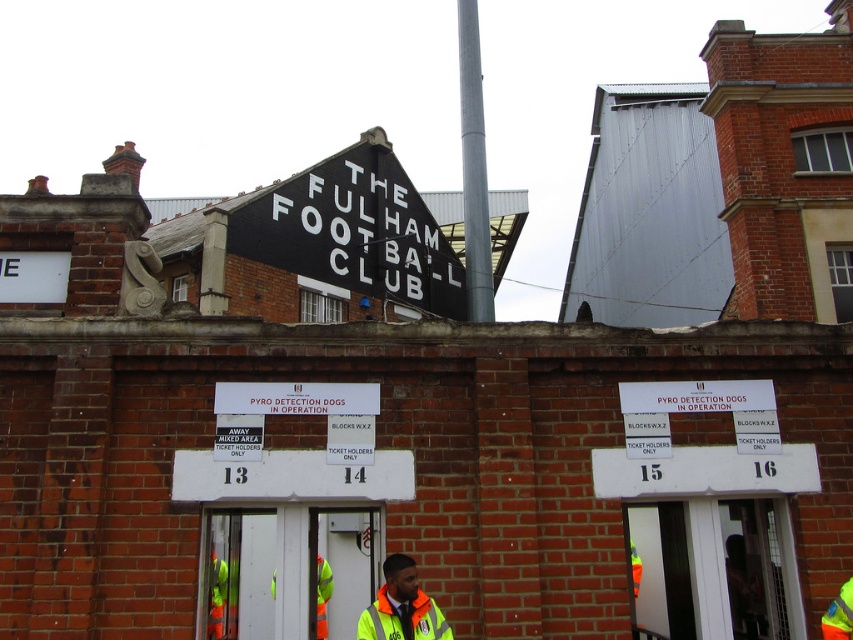
You are a visitor arriving at The Fulham Football Club entrance. You see a silver metallic pole at center and a high visibility jacket at center. Which object is wider from your perspective?

The silver metallic pole at center might be wider than high visibility jacket at center.

You are a delivery person arriving at The Fulham Football Club entrance. You need to place a package on the ground near the silver metallic pole at center. However, there is a height restriction due to the black painted signboard at upper center. Can you safely place the package without hitting the signboard?

The black painted signboard at upper center is not as tall as the silver metallic pole at center, so placing the package near the silver metallic pole at center would not interfere with the signboard since the pole is taller and provides enough vertical clearance.

You are a visitor arriving at The Fulham Football Club entrance. You see a black painted signboard at upper center and a high visibility jacket at center. From your perspective standing at the entrance, which object is positioned to the left?

The black painted signboard at upper center is to the left of the high visibility jacket at center.